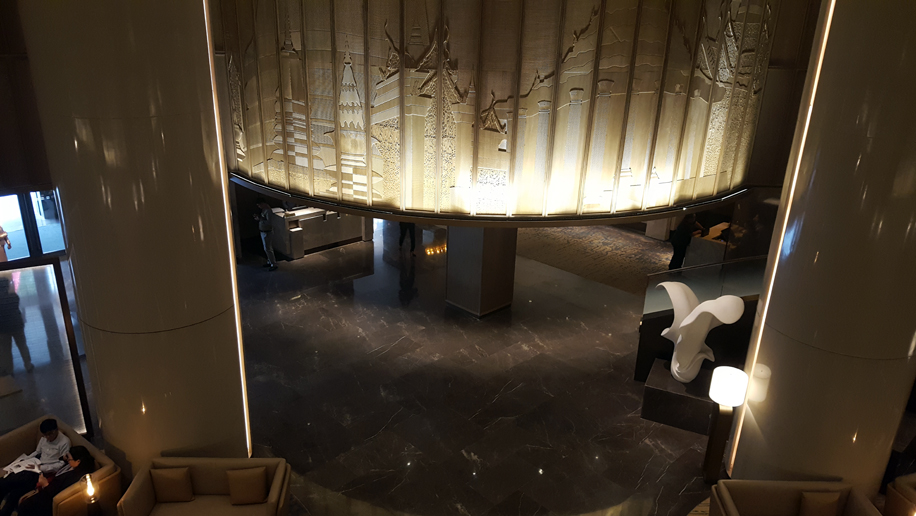
Locate an element on the screen. floor is located at coordinates tap(398, 430).